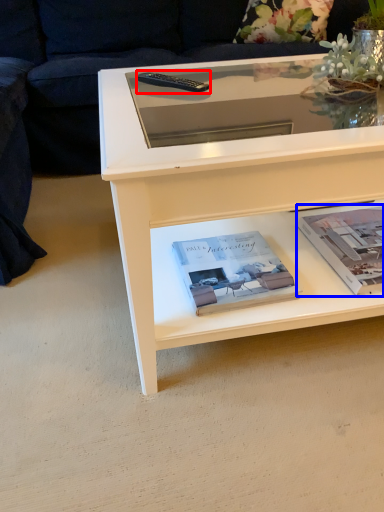
Question: Which point is closer to the camera, remote (highlighted by a red box) or paperback book (highlighted by a blue box)?

Choices:
 (A) remote
 (B) paperback book

Answer: (B)